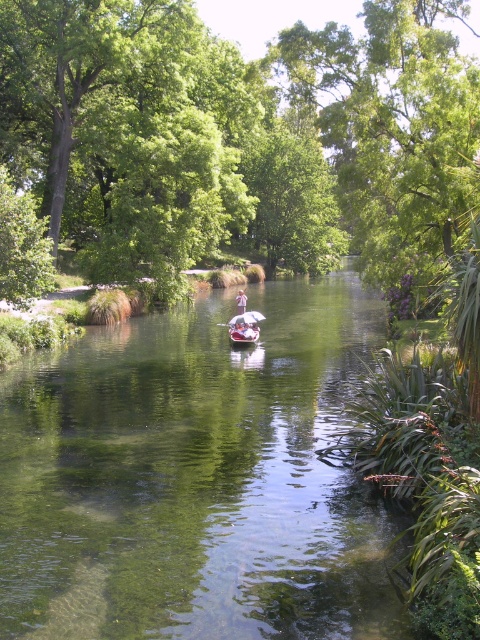
The image size is (480, 640). What do you see at coordinates (237, 140) in the screenshot?
I see `green leafy tree at center` at bounding box center [237, 140].

Between green leafy tree at center and metallic silver kayak at center, which one has more height?

green leafy tree at center is taller.

The width and height of the screenshot is (480, 640). Identify the location of green leafy tree at center. (237, 140).

I want to click on green leafy tree at center, so click(x=237, y=140).

In the scene shown: Does green leafy tree at center have a greater height compared to pink fabric person at center?

Indeed, green leafy tree at center has a greater height compared to pink fabric person at center.

Who is more forward, (168, 102) or (240, 301)?

Positioned in front is point (240, 301).

Who is more distant from viewer, (104,48) or (243,301)?

The point (104,48) is behind.

I want to click on green leafy tree at center, so click(237, 140).

Is metallic silver kayak at center smaller than pink fabric person at center?

Correct, metallic silver kayak at center occupies less space than pink fabric person at center.

Who is positioned more to the right, metallic silver kayak at center or pink fabric person at center?

metallic silver kayak at center

Which is in front, point (256, 317) or point (242, 300)?

Point (256, 317) is more forward.

Image resolution: width=480 pixels, height=640 pixels. I want to click on metallic silver kayak at center, so click(x=244, y=328).